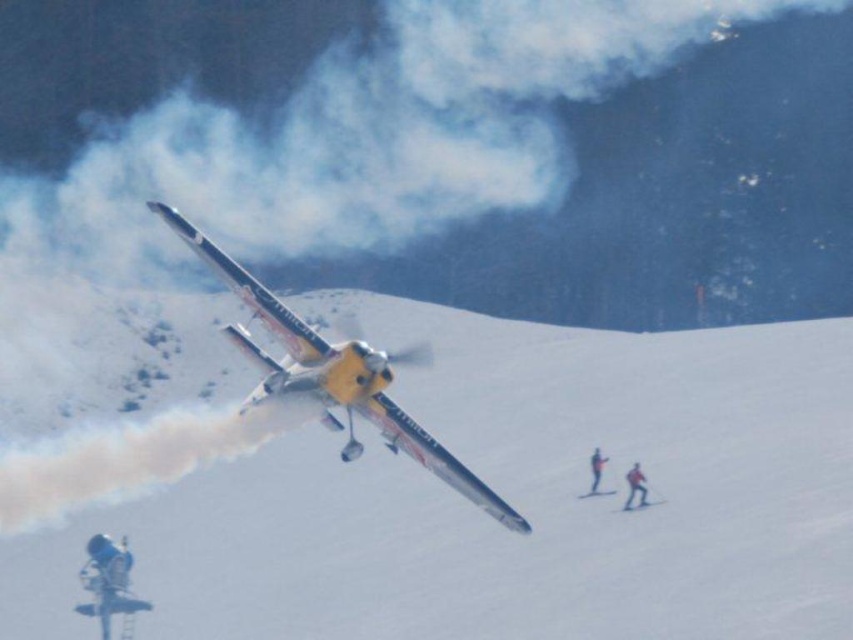
You are a pilot in the yellow glossy aircraft emitting smoke. You notice two skiers below you. Which skier, the red fabric skier at lower right or the yellow fabric skier at lower right, is closer to you?

The red fabric skier at lower right is closer to you than the yellow fabric skier at lower right.

You are a pilot flying a yellow matte airplane at center. You need to land at an airport located near the red fabric skier at lower right. Considering the airplane and skier sizes, can you estimate if the airplane will fit on the standard airport runway?

The yellow matte airplane at center is narrower than the red fabric skier at lower right. Since the skier is small in the image, the airplane might be too large to fit on a standard runway designed for smaller aircraft. However, without knowing the actual size of the runway, it is impossible to confirm.